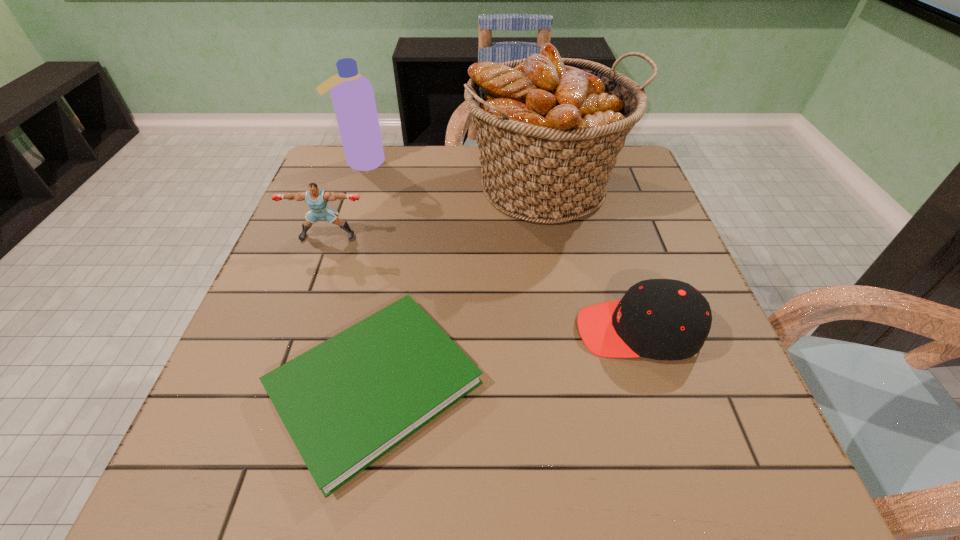
At what (x,y) coordinates should I click in order to perform the action: click on basket. Please return your answer as a coordinate pair (x, y). Image resolution: width=960 pixels, height=540 pixels. Looking at the image, I should click on (549, 129).

Find the location of `the fourth shortest object`. the fourth shortest object is located at coordinates (352, 94).

In order to click on puncher in this screenshot , I will do `click(317, 199)`.

Identify the location of cap. The width and height of the screenshot is (960, 540). pos(662,319).

Where is `paperback book`? paperback book is located at coordinates (348, 401).

The image size is (960, 540). I want to click on vacant space located on the left of the basket, so click(x=448, y=186).

In order to click on free space located on the front of the shampoo in this screenshot , I will do `click(337, 234)`.

Where is `vacant space located on the front-facing side of the third shortest object`? vacant space located on the front-facing side of the third shortest object is located at coordinates (292, 335).

This screenshot has height=540, width=960. What are the coordinates of `free point located on the front-facing side of the fourth tallest object` in the screenshot? It's located at (516, 330).

This screenshot has width=960, height=540. I want to click on blank area located on the front-facing side of the fourth tallest object, so click(427, 330).